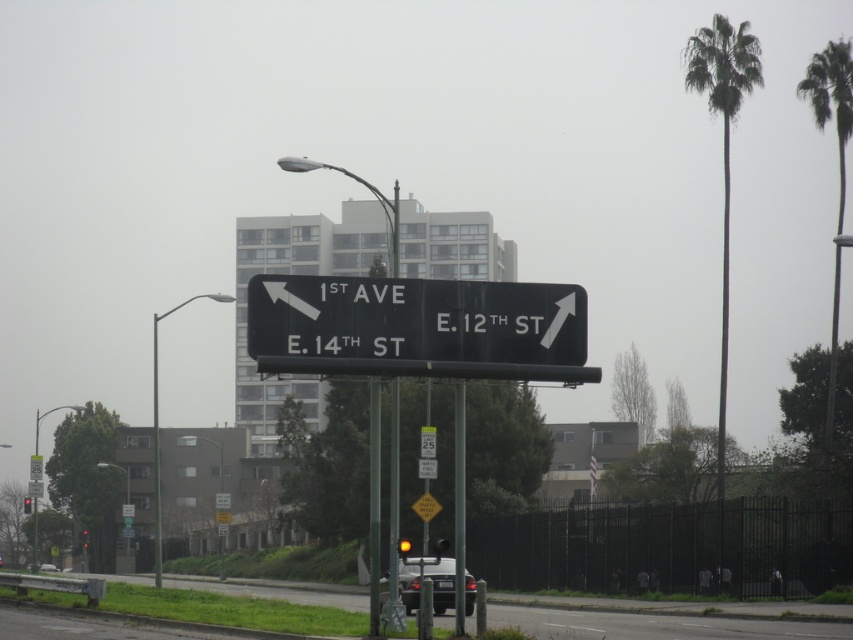
Question: Based on their relative distances, which object is farther from the green leafy palm tree at upper right?

Choices:
 (A) green leafy palm at right
 (B) metallic reflective traffic sign at center

Answer: (B)

Question: Which object is farther from the camera taking this photo?

Choices:
 (A) black plastic sign at center
 (B) green leafy palm at right
 (C) yellow reflective plastic at center

Answer: (C)

Question: Does black plastic sign at center appear on the left side of metallic reflective traffic sign at center?

Choices:
 (A) no
 (B) yes

Answer: (A)

Question: Is green leafy palm at right below yellow plastic traffic sign at center?

Choices:
 (A) no
 (B) yes

Answer: (A)

Question: Is black plastic sign at center bigger than metallic reflective traffic sign at center?

Choices:
 (A) no
 (B) yes

Answer: (A)

Question: Among these points, which one is farthest from the camera?

Choices:
 (A) (152, 360)
 (B) (709, 109)
 (C) (265, 289)
 (D) (36, 492)

Answer: (A)